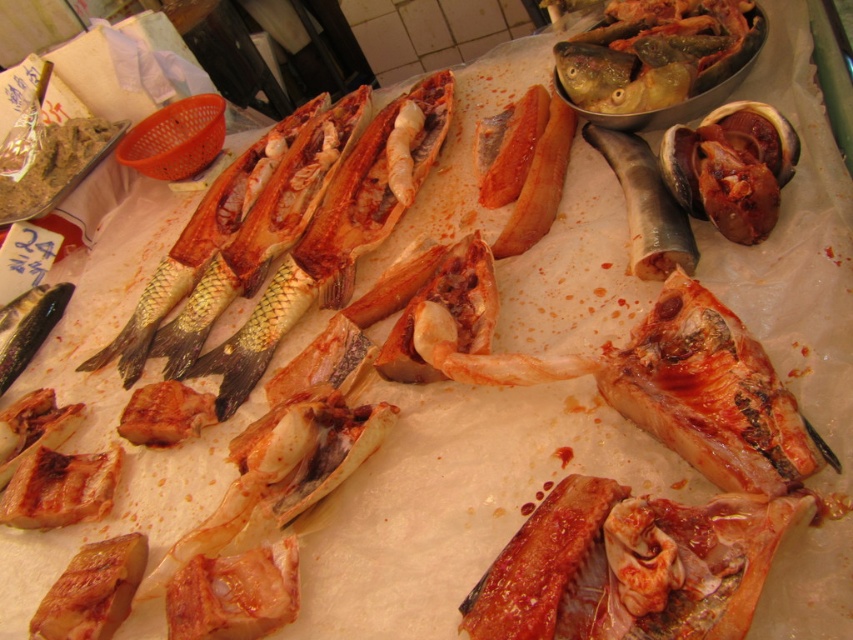
You are a customer at the fish market and want to pick up the shiny silver fish at upper right. You are standing 1.30 meters away from it. Can you reach it without moving closer?

The shiny silver fish at upper right is 1.30 meters away from you. Since the average human arm length is about 0.7 meters, you cannot reach it without moving closer.

You are a customer at the fish market stall. You want to pick up the shiny silver fish at upper right and the shiny silver fish at center. Which one do you need to move first to avoid disturbing the other?

You should move the shiny silver fish at upper right first because it is located above the shiny silver fish at center, so moving it first will prevent it from disturbing the lower one.

You are a customer at the fish market and want to pick up the shiny silver fish at upper right. If your hand can reach 1.20 meters, can you reach it?

The shiny silver fish at upper right is 1.30 meters away from you, so your hand cannot reach it since it is further than 1.20 meters.